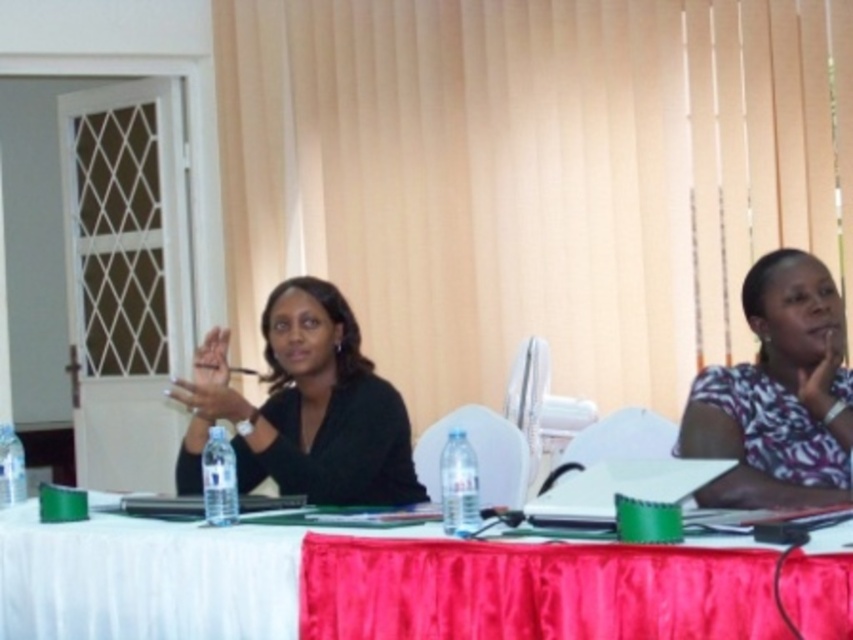
You are organizing a formal event and need to arrange seating based on the attire of the attendees. The black matte shirt at center and the printed cotton shirt at right are part of the seating arrangement. According to the image, which shirt is positioned lower on the table compared to the other?

The black matte shirt at center is below printed cotton shirt at right, so the black matte shirt at center is positioned lower on the table compared to the printed cotton shirt at right.

You are standing at the entrance of the room and see the point marked at coordinates (144, 579). Which object from the scene is this point located on?

The point marked at coordinates (144, 579) is located on the white fabric table at center.